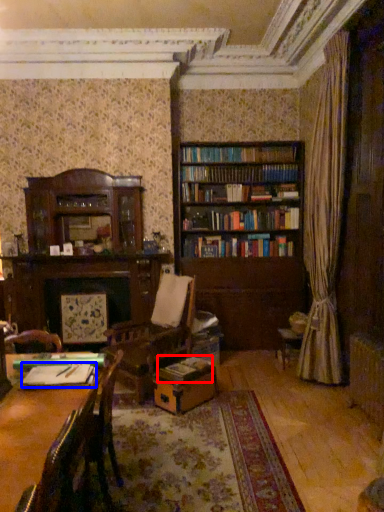
Question: Which of the following is the farthest to the observer, book (highlighted by a red box) or book (highlighted by a blue box)?

Choices:
 (A) book
 (B) book

Answer: (A)